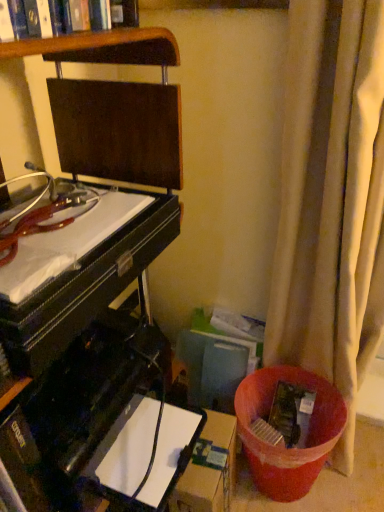
Question: Is brown cardboard box at lower center to the right of black glossy computer desk at left from the viewer's perspective?

Choices:
 (A) no
 (B) yes

Answer: (B)

Question: From a real-world perspective, is brown cardboard box at lower center physically below black glossy computer desk at left?

Choices:
 (A) no
 (B) yes

Answer: (B)

Question: Is brown cardboard box at lower center bigger than black glossy computer desk at left?

Choices:
 (A) no
 (B) yes

Answer: (A)

Question: Does brown cardboard box at lower center touch black glossy computer desk at left?

Choices:
 (A) no
 (B) yes

Answer: (A)

Question: Is brown cardboard box at lower center outside black glossy computer desk at left?

Choices:
 (A) no
 (B) yes

Answer: (B)

Question: Is brown cardboard box at lower center situated inside beige fabric curtain at right or outside?

Choices:
 (A) outside
 (B) inside

Answer: (A)

Question: Is brown cardboard box at lower center taller or shorter than beige fabric curtain at right?

Choices:
 (A) short
 (B) tall

Answer: (A)

Question: From a real-world perspective, relative to beige fabric curtain at right, is brown cardboard box at lower center vertically above or below?

Choices:
 (A) below
 (B) above

Answer: (A)

Question: From the image's perspective, is brown cardboard box at lower center above or below beige fabric curtain at right?

Choices:
 (A) above
 (B) below

Answer: (B)

Question: Considering their positions, is beige fabric curtain at right located in front of or behind brown cardboard box at lower center?

Choices:
 (A) front
 (B) behind

Answer: (A)

Question: In terms of size, does beige fabric curtain at right appear bigger or smaller than brown cardboard box at lower center?

Choices:
 (A) big
 (B) small

Answer: (A)

Question: Is beige fabric curtain at right wider or thinner than brown cardboard box at lower center?

Choices:
 (A) wide
 (B) thin

Answer: (A)

Question: From a real-world perspective, is beige fabric curtain at right above or below brown cardboard box at lower center?

Choices:
 (A) below
 (B) above

Answer: (B)

Question: Considering the positions of black glossy computer desk at left and beige fabric curtain at right in the image, is black glossy computer desk at left wider or thinner than beige fabric curtain at right?

Choices:
 (A) wide
 (B) thin

Answer: (A)

Question: Considering the positions of point (152, 218) and point (284, 324), is point (152, 218) closer or farther from the camera than point (284, 324)?

Choices:
 (A) farther
 (B) closer

Answer: (B)